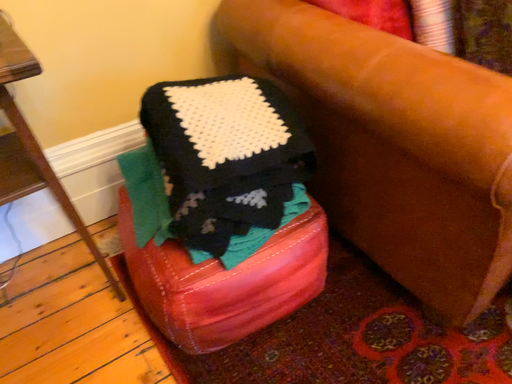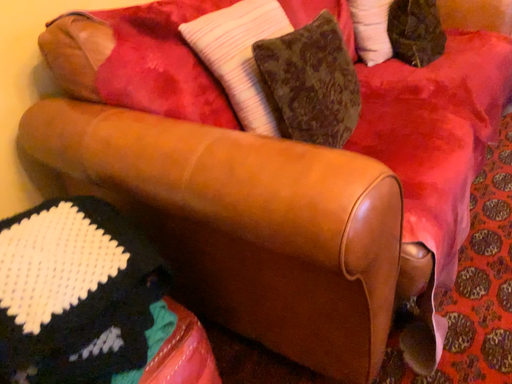
Question: How did the camera likely rotate when shooting the video?

Choices:
 (A) rotated right
 (B) rotated left

Answer: (A)